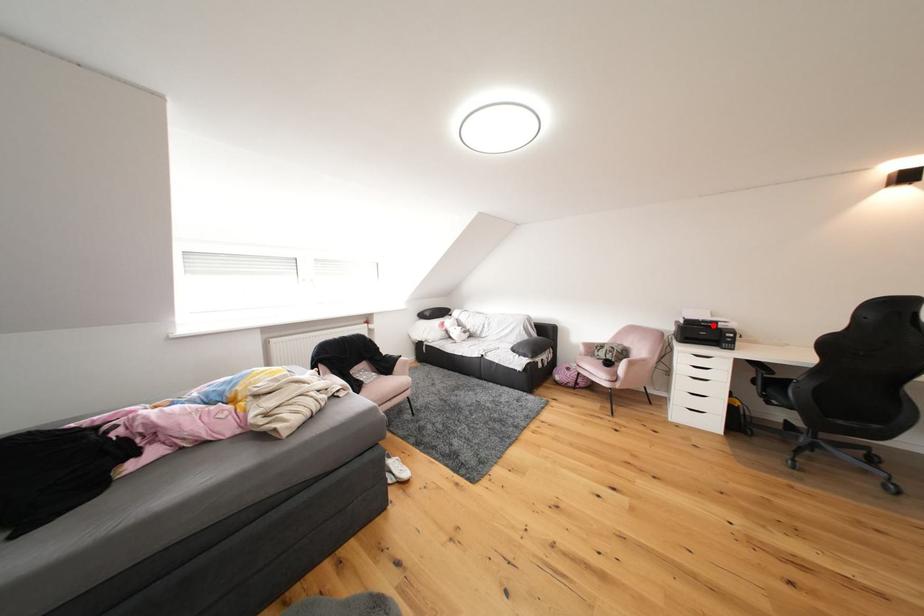
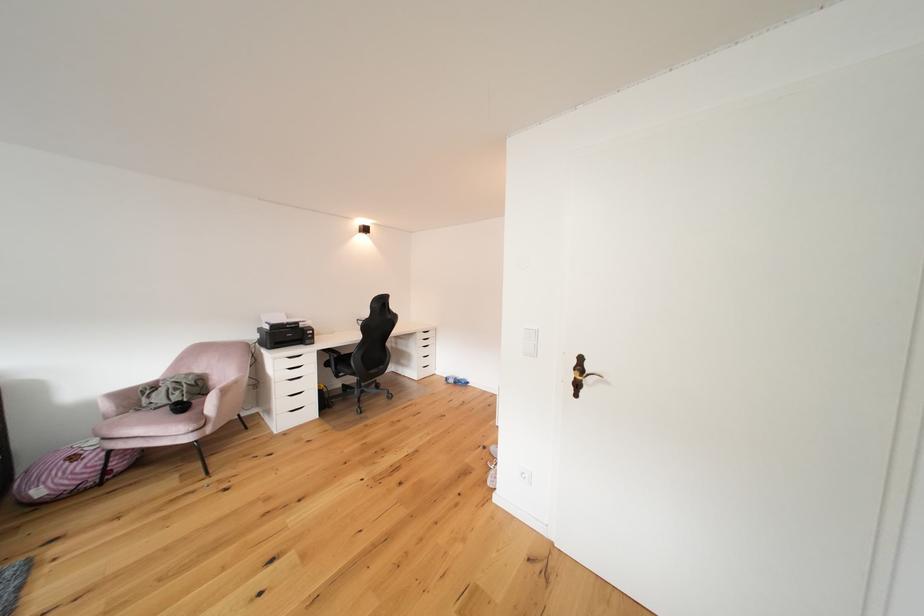
Find the pixel in the second image that matches the highlighted location in the first image.

(298, 328)